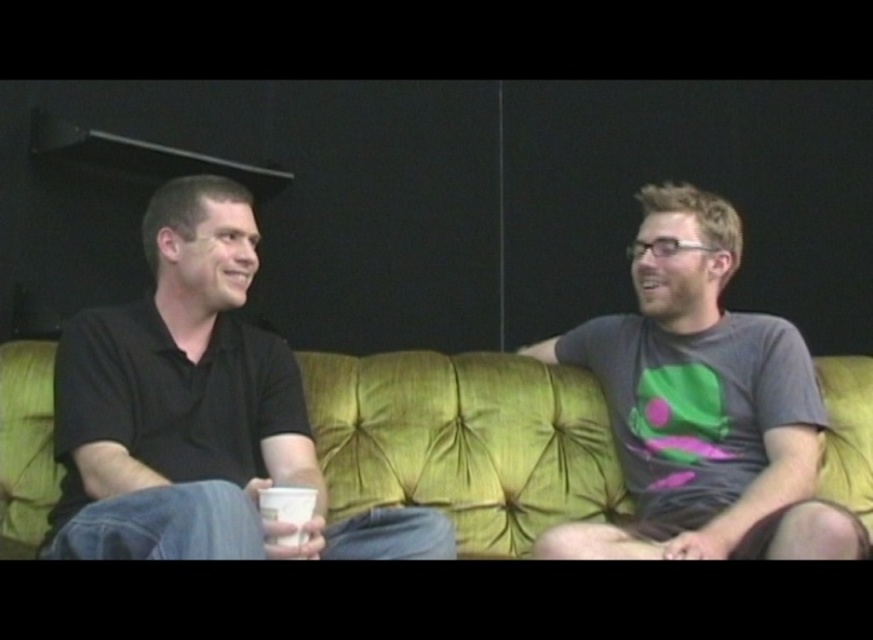
You are standing in front of the sofa where the two people are sitting. You want to place a small plant between the two points marked as point [143,234] and point [535,422]. Which point should the plant be closer to so that it appears closer to you?

The plant should be placed closer to point [143,234] because it is closer to the viewer than point [535,422].